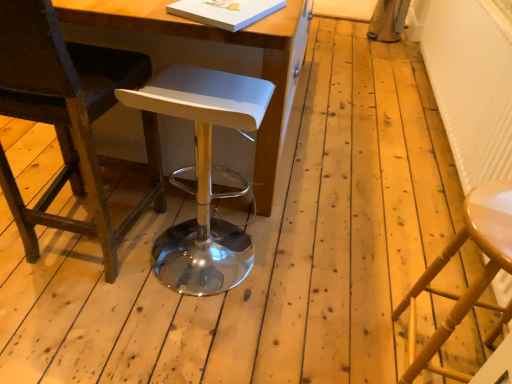
Question: Considering the relative positions of white textured radiator at right and white plastic stool at center, acting as the second stool starting from the right, in the image provided, is white textured radiator at right to the right of white plastic stool at center, acting as the second stool starting from the right, from the viewer's perspective?

Choices:
 (A) yes
 (B) no

Answer: (A)

Question: Is white textured radiator at right far away from white plastic stool at center, marked as the first stool in a left-to-right arrangement?

Choices:
 (A) no
 (B) yes

Answer: (B)

Question: Is white textured radiator at right not within white plastic stool at center, acting as the second stool starting from the right?

Choices:
 (A) no
 (B) yes

Answer: (B)

Question: From a real-world perspective, is white textured radiator at right positioned under white plastic stool at center, marked as the first stool in a left-to-right arrangement, based on gravity?

Choices:
 (A) yes
 (B) no

Answer: (B)

Question: Considering the relative sizes of white textured radiator at right and white plastic stool at center, acting as the second stool starting from the right, in the image provided, is white textured radiator at right shorter than white plastic stool at center, acting as the second stool starting from the right,?

Choices:
 (A) no
 (B) yes

Answer: (A)

Question: From the image's perspective, relative to white plastic stool at center, marked as the first stool in a left-to-right arrangement, is dark brown leather chair at left above or below?

Choices:
 (A) below
 (B) above

Answer: (B)

Question: Based on their sizes in the image, would you say dark brown leather chair at left is bigger or smaller than white plastic stool at center, acting as the second stool starting from the right?

Choices:
 (A) big
 (B) small

Answer: (A)

Question: Considering the positions of dark brown leather chair at left and white plastic stool at center, acting as the second stool starting from the right, in the image, is dark brown leather chair at left wider or thinner than white plastic stool at center, acting as the second stool starting from the right,?

Choices:
 (A) wide
 (B) thin

Answer: (A)

Question: Considering the positions of dark brown leather chair at left and white plastic stool at center, marked as the first stool in a left-to-right arrangement, in the image, is dark brown leather chair at left taller or shorter than white plastic stool at center, marked as the first stool in a left-to-right arrangement,?

Choices:
 (A) tall
 (B) short

Answer: (A)

Question: Considering the positions of wooden table at center and white textured radiator at right in the image, is wooden table at center taller or shorter than white textured radiator at right?

Choices:
 (A) tall
 (B) short

Answer: (A)

Question: Looking at the image, does wooden table at center seem bigger or smaller compared to white textured radiator at right?

Choices:
 (A) small
 (B) big

Answer: (B)

Question: Considering the relative positions of wooden table at center and white textured radiator at right in the image provided, is wooden table at center to the left or to the right of white textured radiator at right?

Choices:
 (A) left
 (B) right

Answer: (A)

Question: Relative to white textured radiator at right, is wooden table at center in front or behind?

Choices:
 (A) front
 (B) behind

Answer: (A)

Question: From the image's perspective, is white plastic stool at center, acting as the second stool starting from the right, located above or below wooden table at center?

Choices:
 (A) below
 (B) above

Answer: (A)

Question: Looking at the image, does white plastic stool at center, marked as the first stool in a left-to-right arrangement, seem bigger or smaller compared to wooden table at center?

Choices:
 (A) big
 (B) small

Answer: (B)